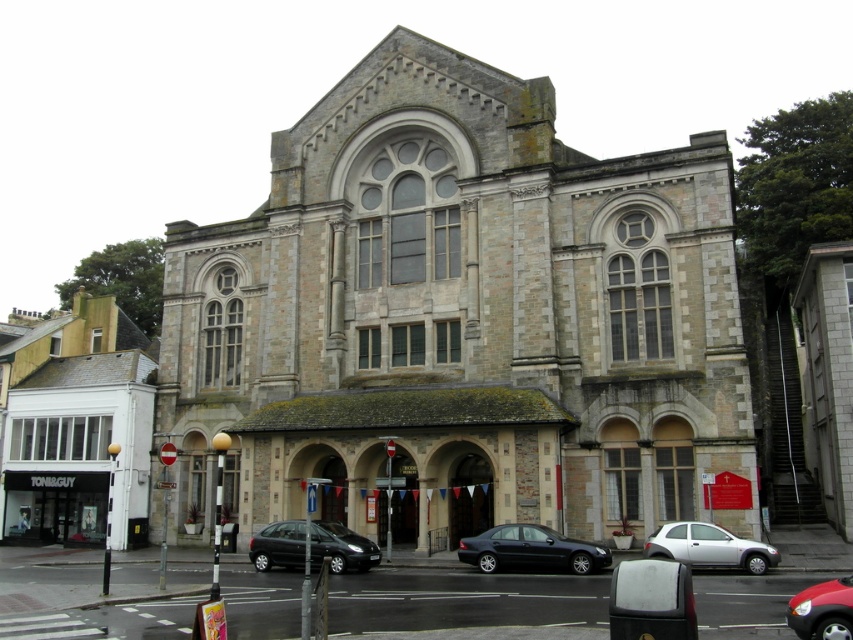
Looking at this image, does stone church at center come in front of shiny red car at lower right?

That is False.

Does stone church at center lie behind shiny red car at lower right?

That is True.

You are a GUI agent. You are given a task and a screenshot of the screen. Output one action in this format:
    pyautogui.click(x=<x>, y=<y>)
    Task: Click on the stone church at center
    
    Given the screenshot: What is the action you would take?
    pyautogui.click(x=460, y=317)

You are a GUI agent. You are given a task and a screenshot of the screen. Output one action in this format:
    pyautogui.click(x=<x>, y=<y>)
    Task: Click on the stone church at center
    
    Given the screenshot: What is the action you would take?
    pyautogui.click(x=460, y=317)

Based on the photo, between stone church at center and silver metallic hatchback at lower center, which one appears on the left side from the viewer's perspective?

stone church at center

The height and width of the screenshot is (640, 853). Describe the element at coordinates (460, 317) in the screenshot. I see `stone church at center` at that location.

This screenshot has height=640, width=853. I want to click on stone church at center, so click(460, 317).

Does shiny black hatchback at center have a larger size compared to silver metallic hatchback at lower center?

Yes, shiny black hatchback at center is bigger than silver metallic hatchback at lower center.

Is shiny black hatchback at center above silver metallic hatchback at lower center?

Incorrect, shiny black hatchback at center is not positioned above silver metallic hatchback at lower center.

Who is more forward, (258, 557) or (712, 525)?

Positioned in front is point (712, 525).

Locate an element on the screen. This screenshot has height=640, width=853. shiny black hatchback at center is located at coordinates (311, 547).